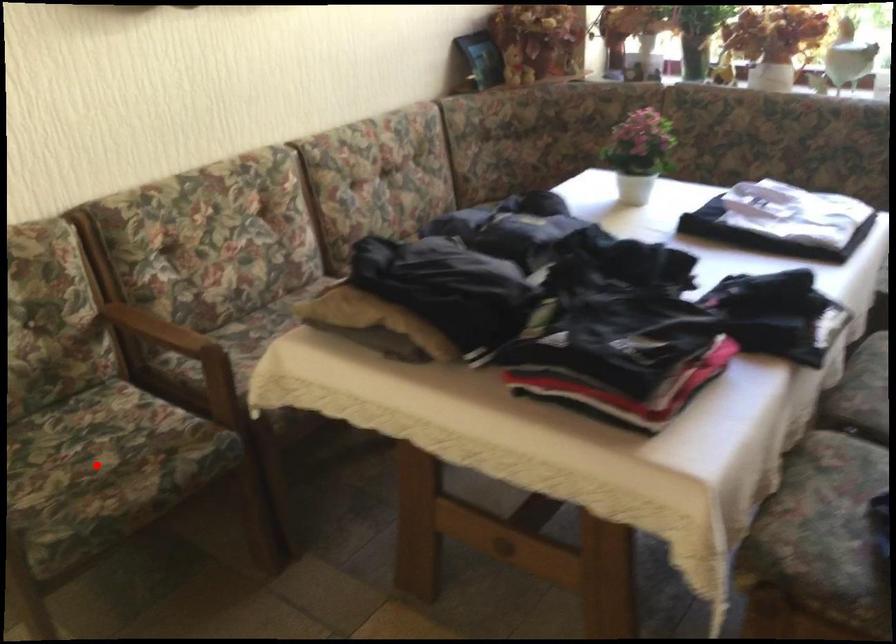
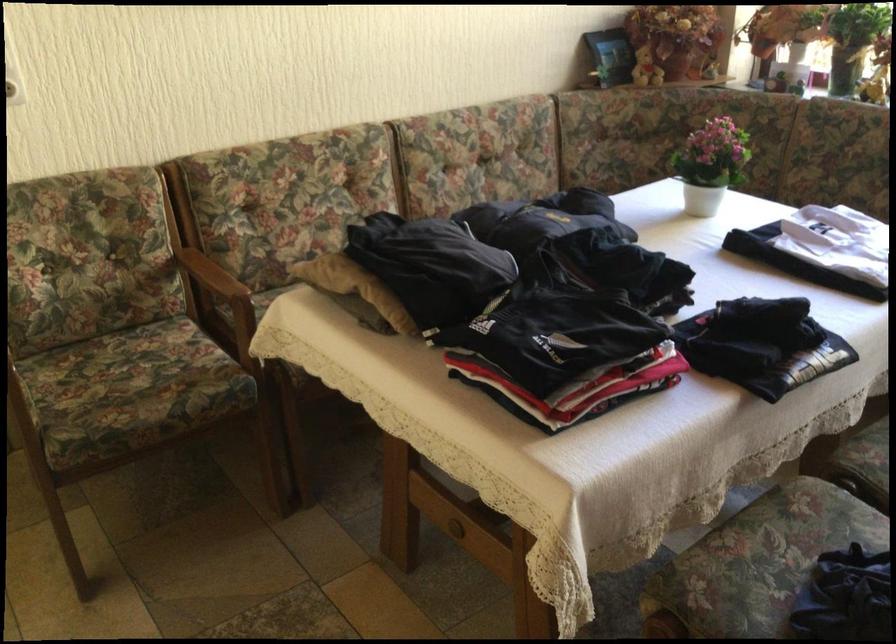
Question: I am providing you with two images of the same scene from different viewpoints. Image1 has a red point marked. In image2, the corresponding 3D location appears at what relative position? Reply with the corresponding letter.

Choices:
 (A) Closer
 (B) Farther

Answer: (B)